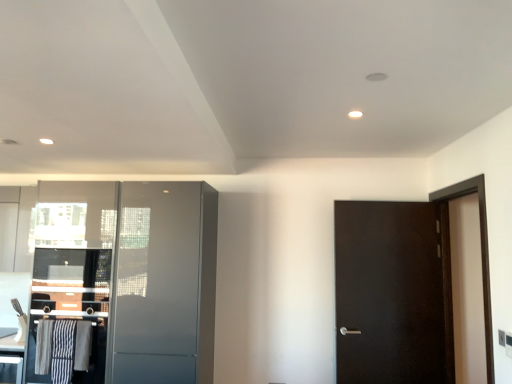
What do you see at coordinates (124, 282) in the screenshot?
I see `glossy gray cabinet at left, the first cabinetry viewed from the top` at bounding box center [124, 282].

In order to face dark wood screen door at right, acting as the 1th screen door starting from the right, should I rotate leftwards or rightwards?

To align with it, rotate right about 26.193°.

Measure the distance between point (481, 181) and camera.

They are 8.69 feet apart.

Locate an element on the screen. The image size is (512, 384). satin gray cabinet at left, the first screen door in the left-to-right sequence is located at coordinates (158, 283).

The image size is (512, 384). What do you see at coordinates (68, 315) in the screenshot? I see `metallic silver cabinet at left, which is the 1th cabinetry in bottom-to-top order` at bounding box center [68, 315].

I want to click on glossy gray cabinet at left, the first cabinetry viewed from the top, so click(124, 282).

Is striped fabric laundry at lower left at the left side of metallic silver cabinet at left, which is the 1th cabinetry in bottom-to-top order?

Indeed, striped fabric laundry at lower left is positioned on the left side of metallic silver cabinet at left, which is the 1th cabinetry in bottom-to-top order.

Is metallic silver cabinet at left, the 2th cabinetry positioned from the top, completely or partially inside striped fabric laundry at lower left?

No, striped fabric laundry at lower left does not contain metallic silver cabinet at left, the 2th cabinetry positioned from the top.

Looking at this image, is striped fabric laundry at lower left wider or thinner than metallic silver cabinet at left, the 2th cabinetry positioned from the top?

Considering their sizes, striped fabric laundry at lower left looks slimmer than metallic silver cabinet at left, the 2th cabinetry positioned from the top.

From the image's perspective, relative to dark wood screen door at right, acting as the 1th screen door starting from the right, is glossy gray cabinet at left, the first cabinetry viewed from the top, above or below?

glossy gray cabinet at left, the first cabinetry viewed from the top, is situated lower than dark wood screen door at right, acting as the 1th screen door starting from the right, in the image.

Does glossy gray cabinet at left, arranged as the 2th cabinetry when ordered from the bottom, have a greater width compared to dark wood screen door at right, which is the 2th screen door from left to right?

Indeed, glossy gray cabinet at left, arranged as the 2th cabinetry when ordered from the bottom, has a greater width compared to dark wood screen door at right, which is the 2th screen door from left to right.

There is a glossy gray cabinet at left, the first cabinetry viewed from the top. What are the coordinates of `the 2nd screen door above it (from a real-world perspective)` in the screenshot? It's located at (481, 253).

Which is in front, point (106, 321) or point (492, 355)?

The point (492, 355) is more forward.

From a real-world perspective, is metallic silver cabinet at left, which is the 1th cabinetry in bottom-to-top order, on dark wood screen door at right, acting as the 1th screen door starting from the right?

No.

From the image's perspective, which is above, metallic silver cabinet at left, which is the 1th cabinetry in bottom-to-top order, or dark wood screen door at right, acting as the 1th screen door starting from the right?

dark wood screen door at right, acting as the 1th screen door starting from the right, is shown above in the image.

Could you tell me if metallic silver cabinet at left, which is the 1th cabinetry in bottom-to-top order, is turned towards dark wood screen door at right, which is the 2th screen door from left to right?

No, metallic silver cabinet at left, which is the 1th cabinetry in bottom-to-top order, is not aimed at dark wood screen door at right, which is the 2th screen door from left to right.

Does point (40, 247) appear closer or farther from the camera than point (481, 229)?

Point (40, 247) is positioned farther from the camera compared to point (481, 229).

Is glossy gray cabinet at left, the first cabinetry viewed from the top, spatially inside metallic silver cabinet at left, the 2th cabinetry positioned from the top, or outside of it?

glossy gray cabinet at left, the first cabinetry viewed from the top, fits inside metallic silver cabinet at left, the 2th cabinetry positioned from the top.

From a real-world perspective, who is located lower, glossy gray cabinet at left, arranged as the 2th cabinetry when ordered from the bottom, or metallic silver cabinet at left, the 2th cabinetry positioned from the top?

metallic silver cabinet at left, the 2th cabinetry positioned from the top, from a real-world perspective.

Does point (39, 259) come closer to viewer compared to point (75, 339)?

No.

The height and width of the screenshot is (384, 512). I want to click on cabinetry that is on the right side of glossy gray cabinet at left, the first cabinetry viewed from the top, so click(x=68, y=315).

Is dark wood screen door at right, which is the 2th screen door from left to right, far from metallic silver cabinet at left, which is the 1th cabinetry in bottom-to-top order?

That's right, there is a large distance between dark wood screen door at right, which is the 2th screen door from left to right, and metallic silver cabinet at left, which is the 1th cabinetry in bottom-to-top order.

From the image's perspective, does dark wood screen door at right, acting as the 1th screen door starting from the right, appear higher than metallic silver cabinet at left, the 2th cabinetry positioned from the top?

Yes, from the image's perspective, dark wood screen door at right, acting as the 1th screen door starting from the right, is over metallic silver cabinet at left, the 2th cabinetry positioned from the top.

In the scene shown: How different are the orientations of dark wood screen door at right, acting as the 1th screen door starting from the right, and metallic silver cabinet at left, which is the 1th cabinetry in bottom-to-top order, in degrees?

The angle between the facing direction of dark wood screen door at right, acting as the 1th screen door starting from the right, and the facing direction of metallic silver cabinet at left, which is the 1th cabinetry in bottom-to-top order, is 91.8 degrees.

Could you tell me if metallic silver cabinet at left, which is the 1th cabinetry in bottom-to-top order, is turned towards satin gray cabinet at left, which is counted as the second screen door, starting from the right?

No, metallic silver cabinet at left, which is the 1th cabinetry in bottom-to-top order, does not turn towards satin gray cabinet at left, which is counted as the second screen door, starting from the right.

From the image's perspective, is metallic silver cabinet at left, the 2th cabinetry positioned from the top, located above or below satin gray cabinet at left, which is counted as the second screen door, starting from the right?

From the image's perspective, metallic silver cabinet at left, the 2th cabinetry positioned from the top, appears below satin gray cabinet at left, which is counted as the second screen door, starting from the right.

Locate an element on the screen. The height and width of the screenshot is (384, 512). the 2nd cabinetry below when counting from the satin gray cabinet at left, the first screen door in the left-to-right sequence (from the image's perspective) is located at coordinates (68, 315).

How far apart are metallic silver cabinet at left, which is the 1th cabinetry in bottom-to-top order, and satin gray cabinet at left, which is counted as the second screen door, starting from the right?

15.16 inches.

Is metallic silver cabinet at left, which is the 1th cabinetry in bottom-to-top order, situated inside striped fabric laundry at lower left or outside?

metallic silver cabinet at left, which is the 1th cabinetry in bottom-to-top order, is outside striped fabric laundry at lower left.

Can you see metallic silver cabinet at left, the 2th cabinetry positioned from the top, touching striped fabric laundry at lower left?

No, metallic silver cabinet at left, the 2th cabinetry positioned from the top, is not next to striped fabric laundry at lower left.

Which object is positioned more to the right, metallic silver cabinet at left, the 2th cabinetry positioned from the top, or striped fabric laundry at lower left?

metallic silver cabinet at left, the 2th cabinetry positioned from the top, is more to the right.

Is point (93, 264) less distant than point (66, 337)?

That is False.

Identify the location of the 1st cabinetry behind the striped fabric laundry at lower left. (68, 315).

What are the coordinates of `the 2nd cabinetry counting from the left of the dark wood screen door at right, acting as the 1th screen door starting from the right` in the screenshot? It's located at (124, 282).

From the picture: Looking at the image, which one is located further to striped fabric laundry at lower left, dark wood screen door at right, which is the 2th screen door from left to right, or satin gray cabinet at left, which is counted as the second screen door, starting from the right?

dark wood screen door at right, which is the 2th screen door from left to right, is further to striped fabric laundry at lower left.

When comparing their distances from striped fabric laundry at lower left, does glossy gray cabinet at left, arranged as the 2th cabinetry when ordered from the bottom, or satin gray cabinet at left, the first screen door in the left-to-right sequence, seem further?

satin gray cabinet at left, the first screen door in the left-to-right sequence, is further to striped fabric laundry at lower left.

Based on their spatial positions, is satin gray cabinet at left, which is counted as the second screen door, starting from the right, or dark wood screen door at right, acting as the 1th screen door starting from the right, closer to striped fabric laundry at lower left?

satin gray cabinet at left, which is counted as the second screen door, starting from the right, is closer to striped fabric laundry at lower left.

Estimate the real-world distances between objects in this image. Which object is closer to satin gray cabinet at left, the first screen door in the left-to-right sequence, metallic silver cabinet at left, which is the 1th cabinetry in bottom-to-top order, or glossy gray cabinet at left, the first cabinetry viewed from the top?

Among the two, glossy gray cabinet at left, the first cabinetry viewed from the top, is located nearer to satin gray cabinet at left, the first screen door in the left-to-right sequence.

When comparing their distances from metallic silver cabinet at left, the 2th cabinetry positioned from the top, does striped fabric laundry at lower left or dark wood screen door at right, which is the 2th screen door from left to right, seem further?

Among the two, dark wood screen door at right, which is the 2th screen door from left to right, is located further to metallic silver cabinet at left, the 2th cabinetry positioned from the top.

Estimate the real-world distances between objects in this image. Which object is further from satin gray cabinet at left, the first screen door in the left-to-right sequence, striped fabric laundry at lower left or dark wood screen door at right, acting as the 1th screen door starting from the right?

Based on the image, dark wood screen door at right, acting as the 1th screen door starting from the right, appears to be further to satin gray cabinet at left, the first screen door in the left-to-right sequence.

Which object lies further to the anchor point metallic silver cabinet at left, the 2th cabinetry positioned from the top, glossy gray cabinet at left, arranged as the 2th cabinetry when ordered from the bottom, or dark wood screen door at right, which is the 2th screen door from left to right?

dark wood screen door at right, which is the 2th screen door from left to right, is positioned further to the anchor metallic silver cabinet at left, the 2th cabinetry positioned from the top.

Looking at the image, which one is located closer to satin gray cabinet at left, which is counted as the second screen door, starting from the right, striped fabric laundry at lower left or metallic silver cabinet at left, which is the 1th cabinetry in bottom-to-top order?

metallic silver cabinet at left, which is the 1th cabinetry in bottom-to-top order, is closer to satin gray cabinet at left, which is counted as the second screen door, starting from the right.

At what (x,y) coordinates should I click in order to perform the action: click on cabinetry situated between glossy gray cabinet at left, arranged as the 2th cabinetry when ordered from the bottom, and satin gray cabinet at left, the first screen door in the left-to-right sequence, from left to right. Please return your answer as a coordinate pair (x, y). This screenshot has height=384, width=512. Looking at the image, I should click on (68, 315).

Identify the location of laundry that lies between glossy gray cabinet at left, arranged as the 2th cabinetry when ordered from the bottom, and metallic silver cabinet at left, the 2th cabinetry positioned from the top, from top to bottom. Image resolution: width=512 pixels, height=384 pixels. (62, 348).

I want to click on cabinetry between glossy gray cabinet at left, arranged as the 2th cabinetry when ordered from the bottom, and dark wood screen door at right, which is the 2th screen door from left to right, in the horizontal direction, so click(x=68, y=315).

Find the location of a particular element. screen door between metallic silver cabinet at left, which is the 1th cabinetry in bottom-to-top order, and dark wood screen door at right, which is the 2th screen door from left to right is located at coordinates (158, 283).